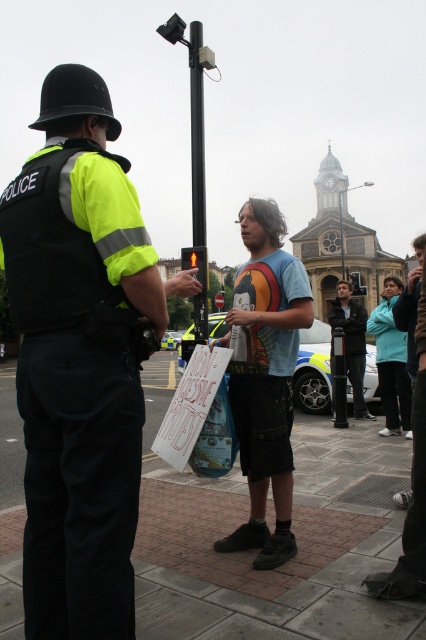
Which is below, matte black uniform at center or matte black jacket at center?

Positioned lower is matte black uniform at center.

Is matte black uniform at center shorter than matte black jacket at center?

No.

Who is more distant from viewer, (80,412) or (347,305)?

The point (347,305) is more distant.

Locate an element on the screen. This screenshot has height=640, width=426. matte black uniform at center is located at coordinates (78, 360).

Between matte black uniform at center and light blue t-shirt at center, which one is positioned lower?

Positioned lower is light blue t-shirt at center.

Is matte black uniform at center positioned in front of light blue t-shirt at center?

Yes.

Where is `matte black uniform at center`? The height and width of the screenshot is (640, 426). matte black uniform at center is located at coordinates (78, 360).

The width and height of the screenshot is (426, 640). Describe the element at coordinates (264, 376) in the screenshot. I see `light blue t-shirt at center` at that location.

Is light blue t-shirt at center below metallic pole at center?

Yes.

Is point (281, 280) positioned before point (193, 24)?

Yes, point (281, 280) is in front of point (193, 24).

Identify the location of light blue t-shirt at center. The image size is (426, 640). (264, 376).